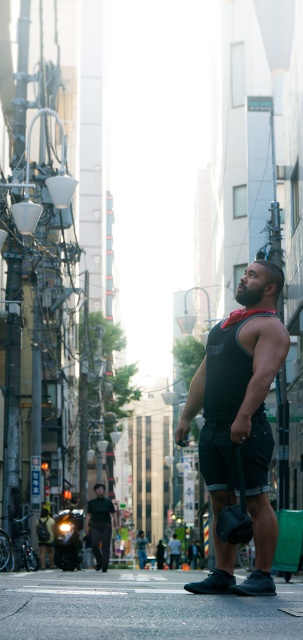
Question: Which of the following is the closest to the observer?

Choices:
 (A) (263, 477)
 (B) (100, 538)

Answer: (A)

Question: Can you confirm if black matte tank top at center is positioned to the left of dark green shirt at lower center?

Choices:
 (A) no
 (B) yes

Answer: (A)

Question: Which of the following is the closest to the observer?

Choices:
 (A) (100, 522)
 (B) (250, 292)

Answer: (B)

Question: From the image, what is the correct spatial relationship of black matte tank top at center in relation to dark green shirt at lower center?

Choices:
 (A) above
 (B) below

Answer: (A)

Question: Does black matte tank top at center have a larger size compared to dark green shirt at lower center?

Choices:
 (A) yes
 (B) no

Answer: (B)

Question: Which point is closer to the camera taking this photo?

Choices:
 (A) (213, 448)
 (B) (109, 516)

Answer: (A)